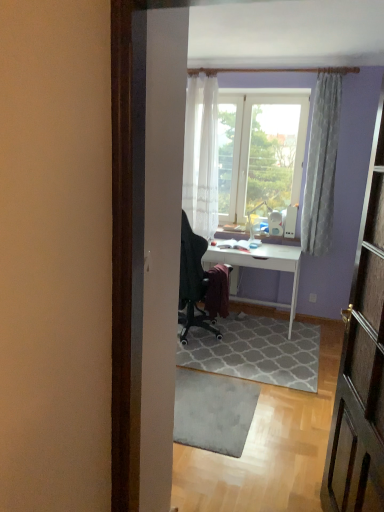
Question: Is gray textured rug at center, marked as the first doormat in a front-to-back arrangement, wider than white sheer curtain at upper center, which appears as the 1th curtain when viewed from the left?

Choices:
 (A) no
 (B) yes

Answer: (B)

Question: From the image's perspective, is gray textured rug at center, marked as the first doormat in a front-to-back arrangement, below white sheer curtain at upper center, which appears as the 1th curtain when viewed from the left?

Choices:
 (A) no
 (B) yes

Answer: (B)

Question: Is the position of gray textured rug at center, marked as the first doormat in a front-to-back arrangement, less distant than that of white sheer curtain at upper center, positioned as the second curtain in right-to-left order?

Choices:
 (A) yes
 (B) no

Answer: (A)

Question: Is white sheer curtain at upper center, which appears as the 1th curtain when viewed from the left, inside gray textured rug at center, which is the 2th doormat from back to front?

Choices:
 (A) no
 (B) yes

Answer: (A)

Question: Can you confirm if gray textured rug at center, marked as the first doormat in a front-to-back arrangement, is positioned to the left of white sheer curtain at upper center, which appears as the 1th curtain when viewed from the left?

Choices:
 (A) yes
 (B) no

Answer: (A)

Question: Is gray textured rug at center, which is the 2th doormat from back to front, far away from white sheer curtain at upper center, which appears as the 1th curtain when viewed from the left?

Choices:
 (A) yes
 (B) no

Answer: (A)

Question: From a real-world perspective, is white textured curtain at upper right, which is the second curtain from left to right, under gray textured rug at center, the 2th doormat positioned from the front?

Choices:
 (A) yes
 (B) no

Answer: (B)

Question: From the image's perspective, would you say white textured curtain at upper right, the first curtain positioned from the right, is positioned over gray textured rug at center, the 2th doormat positioned from the front?

Choices:
 (A) yes
 (B) no

Answer: (A)

Question: From the image's perspective, is white textured curtain at upper right, which is the second curtain from left to right, below gray textured rug at center, the 2th doormat positioned from the front?

Choices:
 (A) no
 (B) yes

Answer: (A)

Question: Is white textured curtain at upper right, which is the second curtain from left to right, taller than gray textured rug at center, positioned as the 1th doormat in back-to-front order?

Choices:
 (A) yes
 (B) no

Answer: (A)

Question: Considering the relative sizes of white textured curtain at upper right, which is the second curtain from left to right, and gray textured rug at center, positioned as the 1th doormat in back-to-front order, in the image provided, is white textured curtain at upper right, which is the second curtain from left to right, shorter than gray textured rug at center, positioned as the 1th doormat in back-to-front order,?

Choices:
 (A) no
 (B) yes

Answer: (A)

Question: Could you tell me if white textured curtain at upper right, the first curtain positioned from the right, is turned towards gray textured rug at center, positioned as the 1th doormat in back-to-front order?

Choices:
 (A) no
 (B) yes

Answer: (A)

Question: Can you confirm if white sheer curtain at upper center, positioned as the second curtain in right-to-left order, is positioned to the left of gray textured rug at center, the 2th doormat positioned from the front?

Choices:
 (A) yes
 (B) no

Answer: (A)